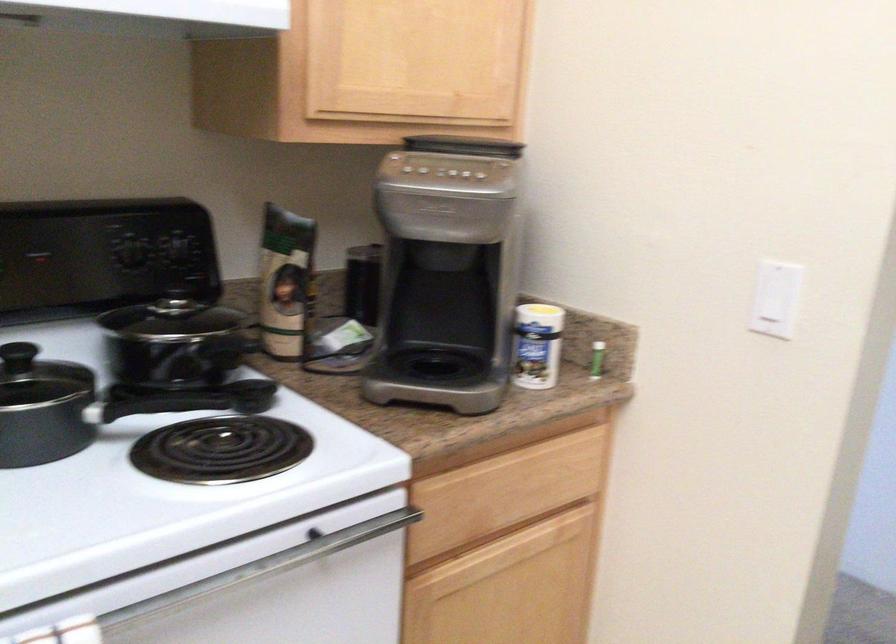
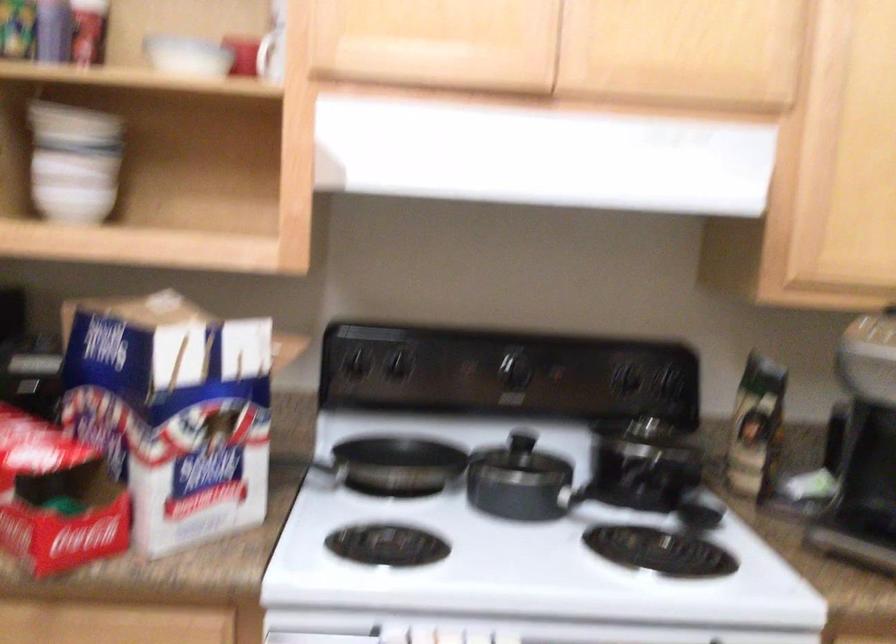
Where in the second image is the point corresponding to pixel 367 125 from the first image?

(847, 283)